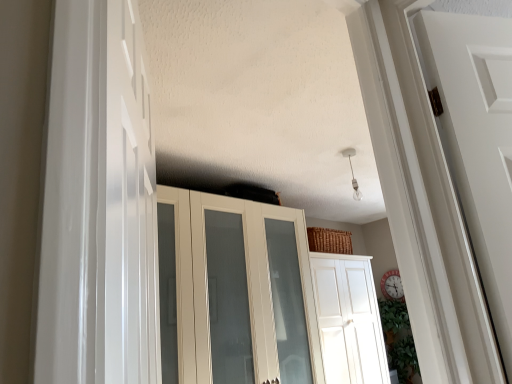
Question: Should I look upward or downward to see white glossy door at left, the first door from the top?

Choices:
 (A) down
 (B) up

Answer: (A)

Question: Is white glossy door at left, arranged as the 2th door when viewed from the right, closer to the viewer compared to white glossy cupboard at center?

Choices:
 (A) yes
 (B) no

Answer: (A)

Question: Is white glossy door at left, the second door when ordered from bottom to top, oriented away from white glossy cupboard at center?

Choices:
 (A) no
 (B) yes

Answer: (A)

Question: From the image's perspective, is white glossy door at left, which is counted as the 1th door, starting from the front, beneath white glossy cupboard at center?

Choices:
 (A) no
 (B) yes

Answer: (A)

Question: Considering the relative sizes of white glossy door at left, the 1th door in the left-to-right sequence, and white glossy cupboard at center in the image provided, is white glossy door at left, the 1th door in the left-to-right sequence, bigger than white glossy cupboard at center?

Choices:
 (A) yes
 (B) no

Answer: (B)

Question: Is white glossy door at left, the second door when ordered from bottom to top, not within white glossy cupboard at center?

Choices:
 (A) no
 (B) yes

Answer: (B)

Question: Is white glossy door at left, the second door when ordered from bottom to top, smaller than white glossy cupboard at center?

Choices:
 (A) yes
 (B) no

Answer: (A)

Question: Considering the relative sizes of white glossy cupboard at center and white glossy door at center, the 1th door in the back-to-front sequence, in the image provided, is white glossy cupboard at center thinner than white glossy door at center, the 1th door in the back-to-front sequence,?

Choices:
 (A) no
 (B) yes

Answer: (A)

Question: From the image's perspective, is white glossy cupboard at center located beneath white glossy door at center, the 1th door in the back-to-front sequence?

Choices:
 (A) yes
 (B) no

Answer: (B)

Question: Does white glossy cupboard at center have a lesser height compared to white glossy door at center, acting as the second door starting from the left?

Choices:
 (A) yes
 (B) no

Answer: (B)

Question: Considering the relative sizes of white glossy cupboard at center and white glossy door at center, the 1th door in the back-to-front sequence, in the image provided, is white glossy cupboard at center taller than white glossy door at center, the 1th door in the back-to-front sequence,?

Choices:
 (A) no
 (B) yes

Answer: (B)

Question: Can you confirm if white glossy cupboard at center is bigger than white glossy door at center, the 2th door positioned from the front?

Choices:
 (A) no
 (B) yes

Answer: (B)

Question: Is white glossy cupboard at center to the left of white glossy door at center, the 1th door in the back-to-front sequence, from the viewer's perspective?

Choices:
 (A) yes
 (B) no

Answer: (A)

Question: Considering the relative positions of white glossy cupboard at center and white glossy door at left, the 1th door in the left-to-right sequence, in the image provided, is white glossy cupboard at center to the right of white glossy door at left, the 1th door in the left-to-right sequence, from the viewer's perspective?

Choices:
 (A) yes
 (B) no

Answer: (A)